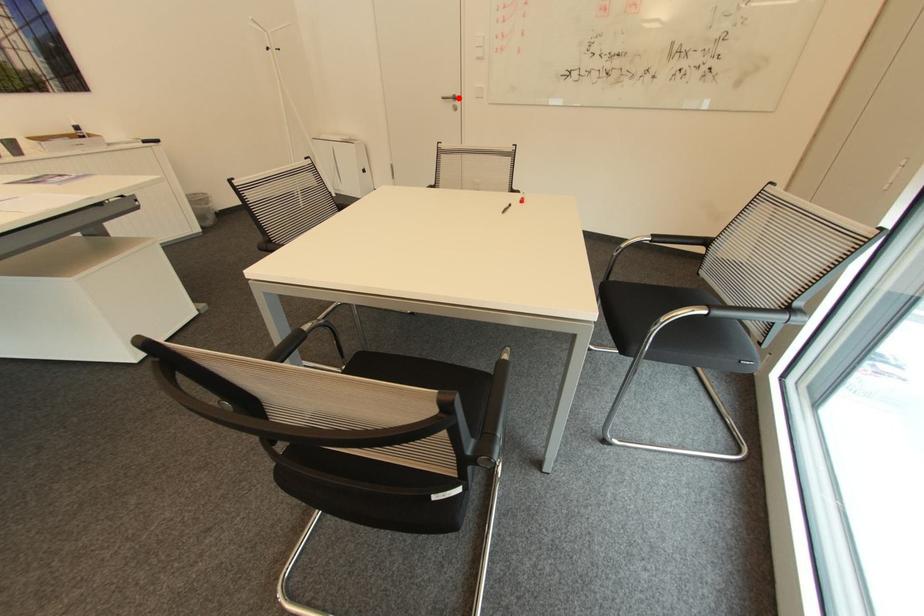
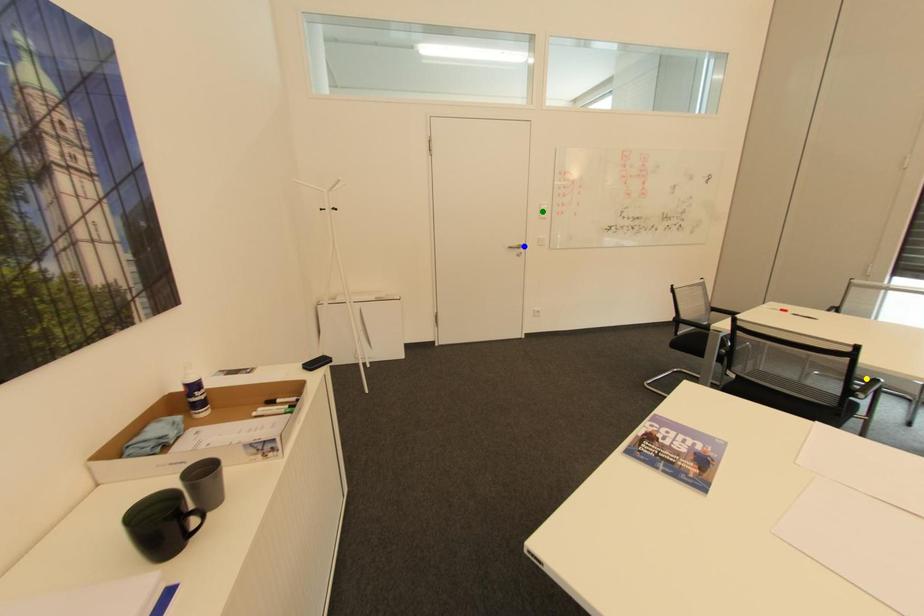
Question: I am providing you with two images of the same scene from different viewpoints. A red point is marked on the first image. You are given multiple points on the second image. In image 2, which mark is for the same physical point as the one in image 1?

Choices:
 (A) green point
 (B) blue point
 (C) yellow point

Answer: (B)